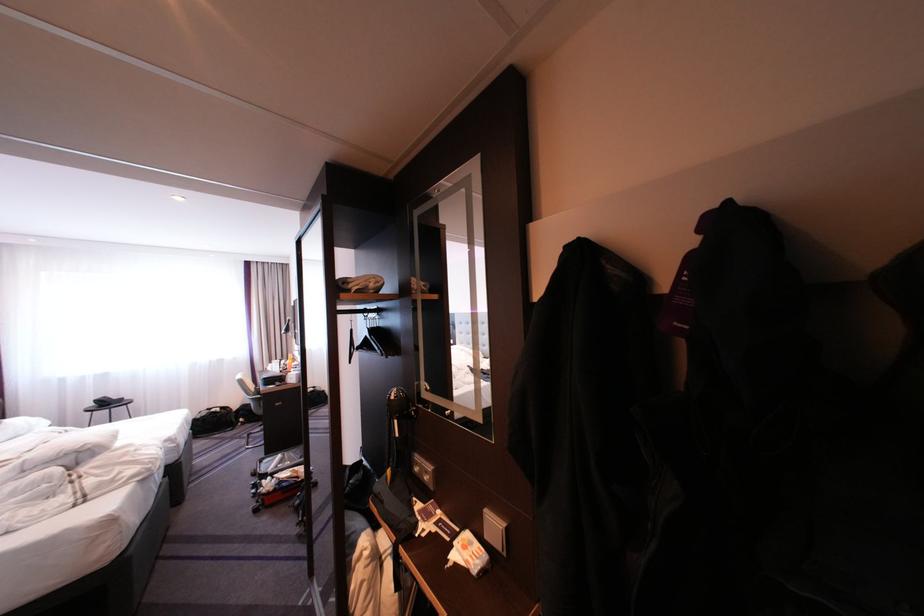
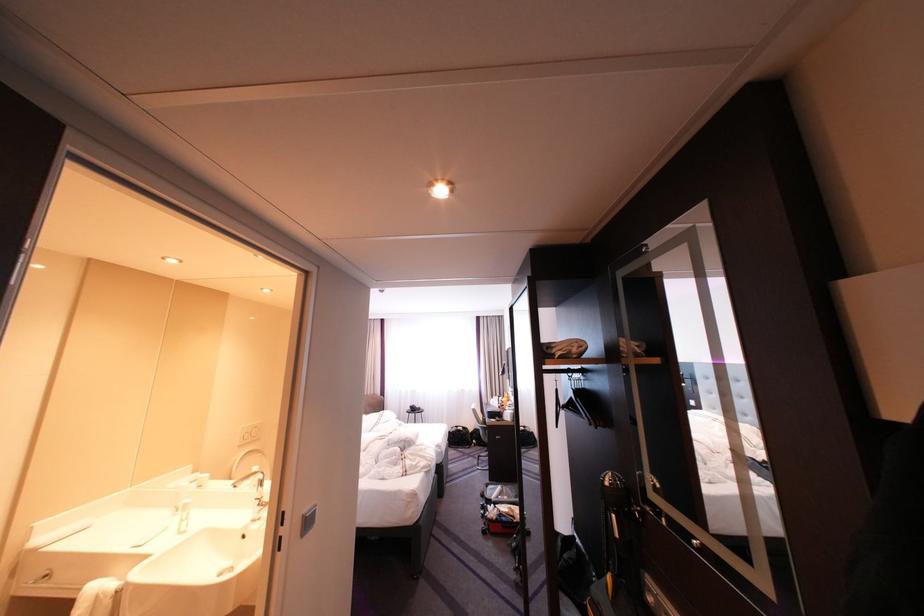
In the second image, find the point that corresponds to point (370, 342) in the first image.

(576, 402)